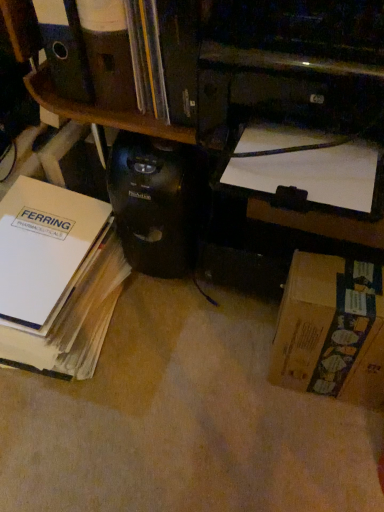
Describe the element at coordinates (305, 166) in the screenshot. Image resolution: width=384 pixels, height=512 pixels. I see `white paper at upper right, which ranks as the 2th book in left-to-right order` at that location.

Describe the element at coordinates (55, 276) in the screenshot. This screenshot has height=512, width=384. I see `white paper at left, the 1th book positioned from the left` at that location.

This screenshot has height=512, width=384. What do you see at coordinates (158, 203) in the screenshot?
I see `black plastic computer tower at center` at bounding box center [158, 203].

The width and height of the screenshot is (384, 512). I want to click on black plastic computer tower at center, so click(158, 203).

I want to click on brown cardboard box at lower right, so click(331, 330).

Is black plastic computer tower at center not within brown cardboard box at lower right?

Yes, black plastic computer tower at center is located beyond the bounds of brown cardboard box at lower right.

Considering the relative positions of black plastic computer tower at center and brown cardboard box at lower right in the image provided, is black plastic computer tower at center in front of brown cardboard box at lower right?

No, the depth of black plastic computer tower at center is greater than that of brown cardboard box at lower right.

Does point (186, 234) lie in front of point (366, 325)?

No, it is not.

How different are the orientations of black plastic computer tower at center and brown cardboard box at lower right in degrees?

They differ by 2.38 degrees in their facing directions.

Is white paper at upper right, which is the first book in right-to-left order, closer to camera compared to black plastic computer tower at center?

Yes, it is in front of black plastic computer tower at center.

From a real-world perspective, is white paper at upper right, which ranks as the 2th book in left-to-right order, physically located above or below black plastic computer tower at center?

white paper at upper right, which ranks as the 2th book in left-to-right order, is above black plastic computer tower at center.

Is white paper at upper right, which ranks as the 2th book in left-to-right order, oriented towards black plastic computer tower at center?

No, white paper at upper right, which ranks as the 2th book in left-to-right order, does not turn towards black plastic computer tower at center.

From the image's perspective, is white paper at upper right, which ranks as the 2th book in left-to-right order, over black plastic computer tower at center?

Actually, white paper at upper right, which ranks as the 2th book in left-to-right order, appears below black plastic computer tower at center in the image.

From the image's perspective, which is above, black plastic printer at upper center or white paper at upper right, which is the first book in right-to-left order?

black plastic printer at upper center, from the image's perspective.

Does point (227, 67) lie behind point (298, 172)?

Yes, it is behind point (298, 172).

From a real-world perspective, who is located higher, black plastic printer at upper center or white paper at upper right, which ranks as the 2th book in left-to-right order?

From a 3D spatial view, black plastic printer at upper center is above.

You are a GUI agent. You are given a task and a screenshot of the screen. Output one action in this format:
    pyautogui.click(x=<x>, y=<y>)
    Task: Click on the 1st book positioned below the black plastic printer at upper center (from the image's perspective)
    This screenshot has width=384, height=512.
    Given the screenshot: What is the action you would take?
    pyautogui.click(x=305, y=166)

Considering the sizes of objects black plastic printer at upper center and brown cardboard box at lower right in the image provided, who is wider, black plastic printer at upper center or brown cardboard box at lower right?

black plastic printer at upper center is wider.

In terms of height, does black plastic printer at upper center look taller or shorter compared to brown cardboard box at lower right?

Considering their sizes, black plastic printer at upper center has less height than brown cardboard box at lower right.

Can you confirm if black plastic printer at upper center is positioned to the right of brown cardboard box at lower right?

No.

What's the angular difference between black plastic printer at upper center and brown cardboard box at lower right's facing directions?

3.72 degrees.

The width and height of the screenshot is (384, 512). Identify the location of box to the right of white paper at left, the 1th book positioned from the left. (331, 330).

Is brown cardboard box at lower right surrounded by white paper at left, which ranks as the second book in right-to-left order?

No, brown cardboard box at lower right is not a part of white paper at left, which ranks as the second book in right-to-left order.

Which object is further away from the camera, white paper at left, the 1th book positioned from the left, or brown cardboard box at lower right?

white paper at left, the 1th book positioned from the left, is further away from the camera.

Considering the sizes of objects white paper at upper right, which ranks as the 2th book in left-to-right order, and brown cardboard box at lower right in the image provided, who is bigger, white paper at upper right, which ranks as the 2th book in left-to-right order, or brown cardboard box at lower right?

brown cardboard box at lower right.

Is white paper at upper right, which ranks as the 2th book in left-to-right order, turned away from brown cardboard box at lower right?

white paper at upper right, which ranks as the 2th book in left-to-right order, does not have its back to brown cardboard box at lower right.

From a real-world perspective, who is located higher, white paper at upper right, which is the first book in right-to-left order, or brown cardboard box at lower right?

white paper at upper right, which is the first book in right-to-left order, is physically above.

Based on the photo, from the image's perspective, is white paper at upper right, which is the first book in right-to-left order, on top of brown cardboard box at lower right?

Indeed, from the image's perspective, white paper at upper right, which is the first book in right-to-left order, is shown above brown cardboard box at lower right.

Which is more to the left, black plastic printer at upper center or black plastic computer tower at center?

Positioned to the left is black plastic computer tower at center.

Is point (261, 12) closer or farther from the camera than point (163, 268)?

Point (261, 12) is positioned closer to the camera compared to point (163, 268).

Is black plastic printer at upper center closer to the viewer compared to black plastic computer tower at center?

Yes, the depth of black plastic printer at upper center is less than that of black plastic computer tower at center.

Is black plastic printer at upper center placed right next to black plastic computer tower at center?

No.

This screenshot has height=512, width=384. I want to click on box that is in front of the black plastic computer tower at center, so click(x=331, y=330).

Locate an element on the screen. This screenshot has height=512, width=384. the 1st book below the black plastic computer tower at center (from the image's perspective) is located at coordinates (305, 166).

From the picture: Estimate the real-world distances between objects in this image. Which object is closer to white paper at left, which ranks as the second book in right-to-left order, black plastic computer tower at center or brown cardboard box at lower right?

Based on the image, black plastic computer tower at center appears to be nearer to white paper at left, which ranks as the second book in right-to-left order.

From the image, which object appears to be nearer to black plastic printer at upper center, black plastic computer tower at center or white paper at upper right, which is the first book in right-to-left order?

white paper at upper right, which is the first book in right-to-left order, is positioned closer to the anchor black plastic printer at upper center.

When comparing their distances from brown cardboard box at lower right, does black plastic computer tower at center or black plastic printer at upper center seem further?

Among the two, black plastic printer at upper center is located further to brown cardboard box at lower right.

In the scene shown: Based on their spatial positions, is black plastic computer tower at center or white paper at upper right, which is the first book in right-to-left order, closer to white paper at left, the 1th book positioned from the left?

black plastic computer tower at center lies closer to white paper at left, the 1th book positioned from the left, than the other object.

Which object lies further to the anchor point black plastic computer tower at center, black plastic printer at upper center or white paper at upper right, which ranks as the 2th book in left-to-right order?

white paper at upper right, which ranks as the 2th book in left-to-right order, lies further to black plastic computer tower at center than the other object.

When comparing their distances from black plastic printer at upper center, does brown cardboard box at lower right or white paper at left, which ranks as the second book in right-to-left order, seem further?

white paper at left, which ranks as the second book in right-to-left order, is positioned further to the anchor black plastic printer at upper center.

Estimate the real-world distances between objects in this image. Which object is further from black plastic printer at upper center, white paper at left, the 1th book positioned from the left, or brown cardboard box at lower right?

white paper at left, the 1th book positioned from the left.

Considering their positions, is white paper at upper right, which is the first book in right-to-left order, positioned closer to black plastic computer tower at center than black plastic printer at upper center?

black plastic printer at upper center is closer to black plastic computer tower at center.

Locate an element on the screen. This screenshot has width=384, height=512. book between black plastic computer tower at center and brown cardboard box at lower right from left to right is located at coordinates (305, 166).

You are a GUI agent. You are given a task and a screenshot of the screen. Output one action in this format:
    pyautogui.click(x=<x>, y=<y>)
    Task: Click on the computer tower situated between white paper at left, which ranks as the second book in right-to-left order, and white paper at upper right, which ranks as the 2th book in left-to-right order, from left to right
    The image size is (384, 512).
    Given the screenshot: What is the action you would take?
    pyautogui.click(x=158, y=203)

Where is `book between white paper at left, which ranks as the second book in right-to-left order, and brown cardboard box at lower right from left to right`? book between white paper at left, which ranks as the second book in right-to-left order, and brown cardboard box at lower right from left to right is located at coordinates (305, 166).

Locate an element on the screen. printer between white paper at left, the 1th book positioned from the left, and white paper at upper right, which is the first book in right-to-left order is located at coordinates (273, 60).